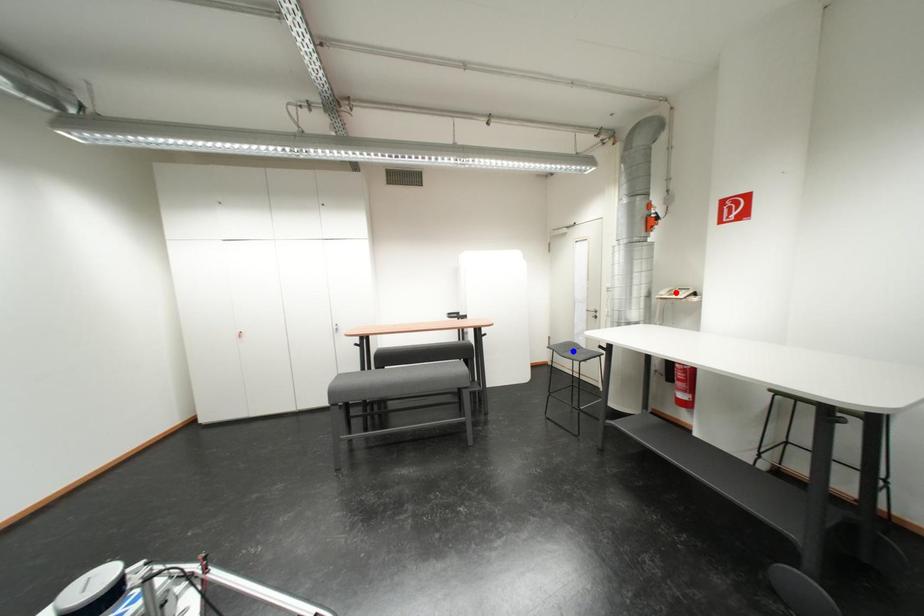
Question: In the image, two points are highlighted. Which point is nearer to the camera? Reply with the corresponding letter.

Choices:
 (A) blue point
 (B) red point

Answer: (B)